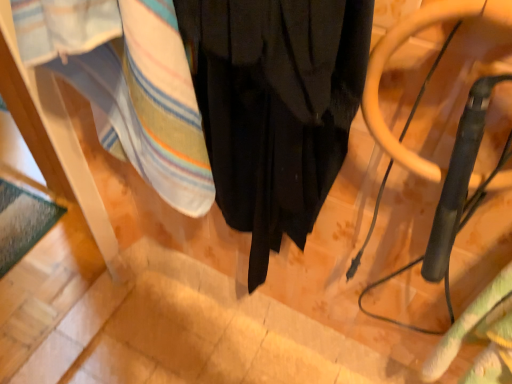
Question: Is metallic gray swivel chair at right shorter than black matte curtain at center?

Choices:
 (A) no
 (B) yes

Answer: (B)

Question: From a real-world perspective, is metallic gray swivel chair at right beneath black matte curtain at center?

Choices:
 (A) no
 (B) yes

Answer: (A)

Question: Is metallic gray swivel chair at right aimed at black matte curtain at center?

Choices:
 (A) no
 (B) yes

Answer: (A)

Question: From a real-world perspective, is metallic gray swivel chair at right physically above black matte curtain at center?

Choices:
 (A) no
 (B) yes

Answer: (B)

Question: Is metallic gray swivel chair at right located outside black matte curtain at center?

Choices:
 (A) no
 (B) yes

Answer: (B)

Question: Is metallic gray swivel chair at right thinner than black matte curtain at center?

Choices:
 (A) no
 (B) yes

Answer: (B)

Question: Does green textured blanket at lower right, acting as the first blanket starting from the bottom, appear on the left side of metallic gray swivel chair at right?

Choices:
 (A) yes
 (B) no

Answer: (B)

Question: Is green textured blanket at lower right, acting as the first blanket starting from the bottom, thinner than metallic gray swivel chair at right?

Choices:
 (A) no
 (B) yes

Answer: (A)

Question: Are green textured blanket at lower right, acting as the first blanket starting from the bottom, and metallic gray swivel chair at right far apart?

Choices:
 (A) yes
 (B) no

Answer: (B)

Question: Considering the relative sizes of green textured blanket at lower right, the first blanket in the right-to-left sequence, and metallic gray swivel chair at right in the image provided, is green textured blanket at lower right, the first blanket in the right-to-left sequence, shorter than metallic gray swivel chair at right?

Choices:
 (A) no
 (B) yes

Answer: (B)

Question: Does green textured blanket at lower right, arranged as the second blanket when viewed from the top, have a larger size compared to metallic gray swivel chair at right?

Choices:
 (A) yes
 (B) no

Answer: (A)

Question: From a real-world perspective, does green textured blanket at lower right, acting as the first blanket starting from the bottom, stand above metallic gray swivel chair at right?

Choices:
 (A) no
 (B) yes

Answer: (A)

Question: Does black matte curtain at center appear on the left side of metallic gray swivel chair at right?

Choices:
 (A) yes
 (B) no

Answer: (A)